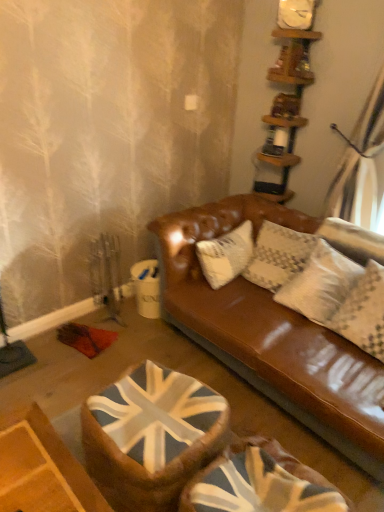
Question: Is white textured pillow at upper right bigger than union jack fabric swivel chair at lower center, which is counted as the 1th swivel chair, starting from the right?

Choices:
 (A) yes
 (B) no

Answer: (B)

Question: Is white textured pillow at upper right taller than union jack fabric swivel chair at lower center, which is counted as the 1th swivel chair, starting from the right?

Choices:
 (A) yes
 (B) no

Answer: (B)

Question: Is white textured pillow at upper right in front of union jack fabric swivel chair at lower center, which is the 2th swivel chair from left to right?

Choices:
 (A) no
 (B) yes

Answer: (A)

Question: Can you confirm if white textured pillow at upper right is thinner than union jack fabric swivel chair at lower center, which is counted as the 1th swivel chair, starting from the right?

Choices:
 (A) no
 (B) yes

Answer: (B)

Question: From the image's perspective, is white textured pillow at upper right above union jack fabric swivel chair at lower center, which is counted as the 1th swivel chair, starting from the right?

Choices:
 (A) yes
 (B) no

Answer: (A)

Question: From a real-world perspective, relative to union jack fabric swivel chair at lower center, which is counted as the 1th swivel chair, starting from the right, is white textured pillow at upper right vertically above or below?

Choices:
 (A) above
 (B) below

Answer: (A)

Question: From their relative heights in the image, would you say white textured pillow at upper right is taller or shorter than union jack fabric swivel chair at lower center, which is counted as the 1th swivel chair, starting from the right?

Choices:
 (A) tall
 (B) short

Answer: (B)

Question: In the image, is white textured pillow at upper right on the left side or the right side of union jack fabric swivel chair at lower center, which is the 2th swivel chair from left to right?

Choices:
 (A) left
 (B) right

Answer: (B)

Question: In terms of width, does white textured pillow at upper right look wider or thinner when compared to union jack fabric swivel chair at lower center, which is counted as the 1th swivel chair, starting from the right?

Choices:
 (A) wide
 (B) thin

Answer: (B)

Question: Visually, is union jack fabric swivel chair at center, which ranks as the first swivel chair in left-to-right order, positioned to the left or to the right of wooden shelves at upper right?

Choices:
 (A) right
 (B) left

Answer: (B)

Question: Is union jack fabric swivel chair at center, which ranks as the first swivel chair in left-to-right order, in front of or behind wooden shelves at upper right in the image?

Choices:
 (A) behind
 (B) front

Answer: (B)

Question: Looking at the image, does union jack fabric swivel chair at center, positioned as the second swivel chair in right-to-left order, seem bigger or smaller compared to wooden shelves at upper right?

Choices:
 (A) small
 (B) big

Answer: (B)

Question: From a real-world perspective, is union jack fabric swivel chair at center, which ranks as the first swivel chair in left-to-right order, physically located above or below wooden shelves at upper right?

Choices:
 (A) above
 (B) below

Answer: (B)

Question: Is white matte clock at upper center inside the boundaries of wooden shelves at upper right, or outside?

Choices:
 (A) inside
 (B) outside

Answer: (B)

Question: Is white matte clock at upper center wider or thinner than wooden shelves at upper right?

Choices:
 (A) thin
 (B) wide

Answer: (A)